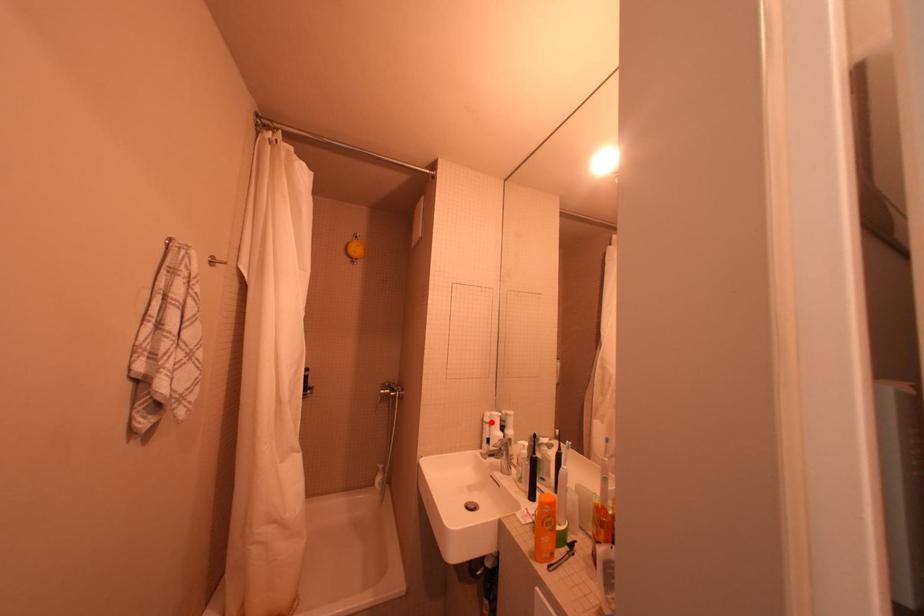
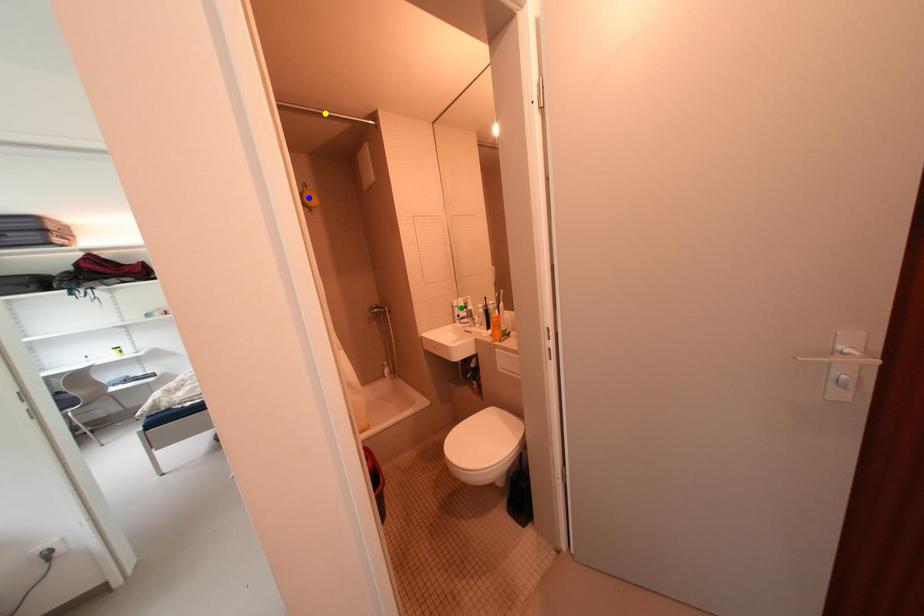
Question: I am providing you with two images of the same scene from different viewpoints. A red point is marked on the first image. You are given multiple points on the second image. Which point in image 2 is actually the same real-world point as the red point in image 1?

Choices:
 (A) yellow point
 (B) blue point
 (C) green point

Answer: (C)